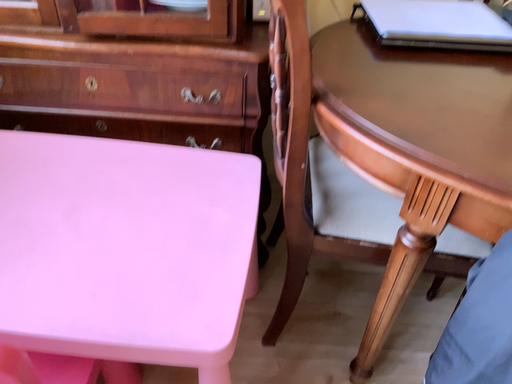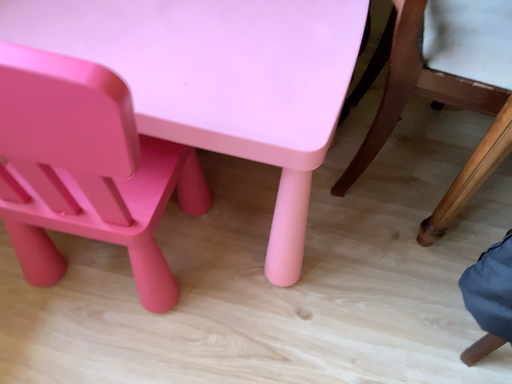
Question: Which way did the camera rotate in the video?

Choices:
 (A) rotated downward
 (B) rotated upward

Answer: (A)